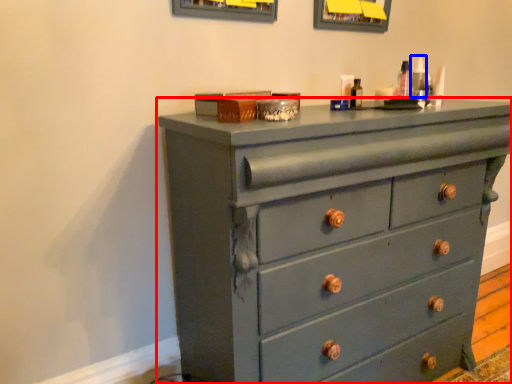
Question: Which of the following is the closest to the observer, chest of drawers (highlighted by a red box) or toiletry (highlighted by a blue box)?

Choices:
 (A) chest of drawers
 (B) toiletry

Answer: (A)